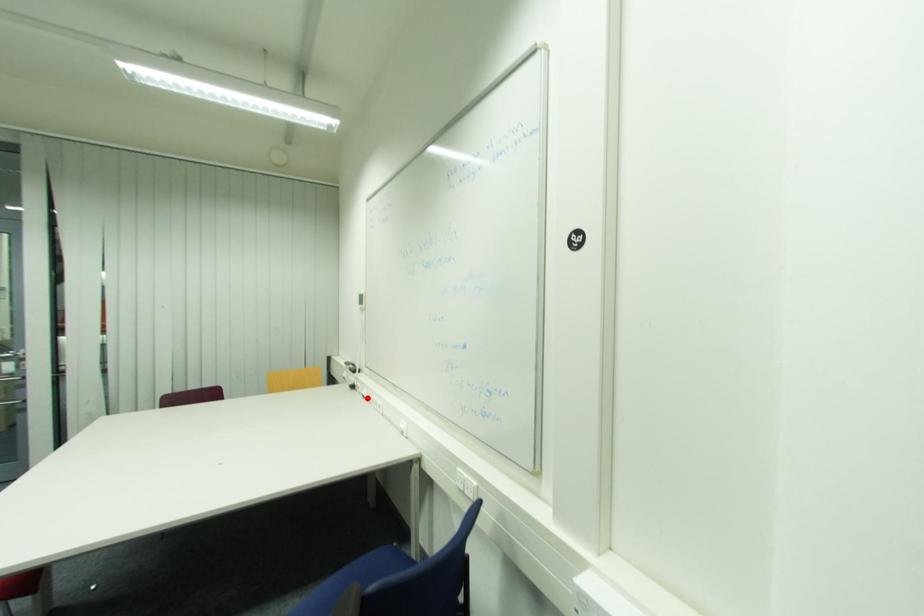
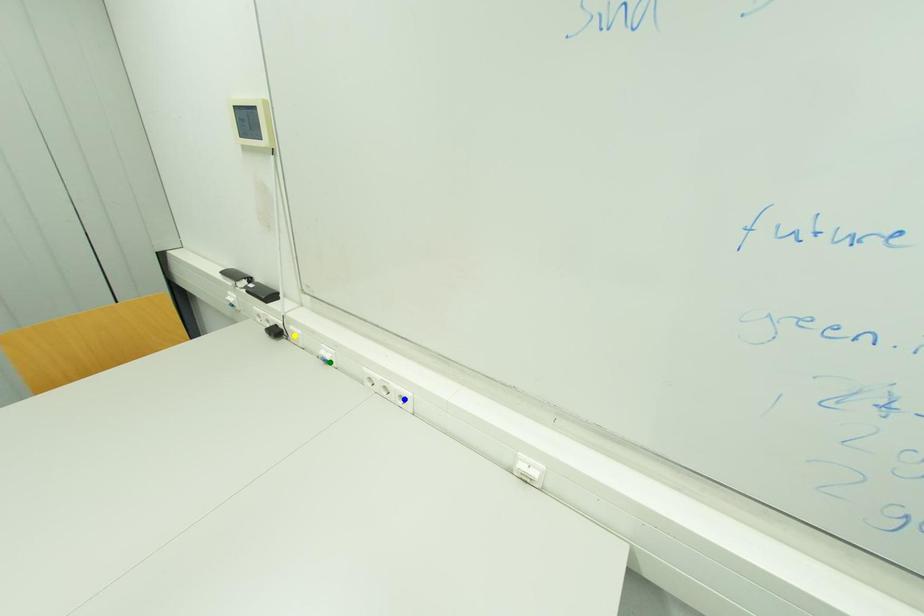
Question: I am providing you with two images of the same scene from different viewpoints. A red point is marked on the first image. You are given multiple points on the second image. Which mark in image 2 goes with the point in image 1?

Choices:
 (A) yellow point
 (B) blue point
 (C) green point

Answer: (C)